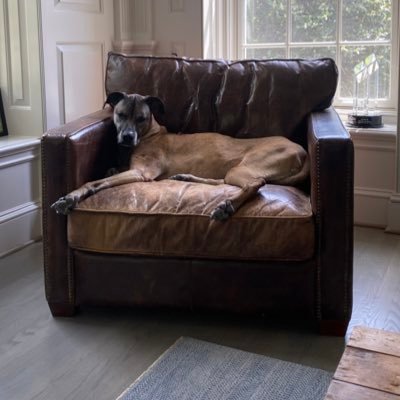
You are a GUI agent. You are given a task and a screenshot of the screen. Output one action in this format:
    pyautogui.click(x=<x>, y=<y>)
    Task: Click on the armsof chair
    This screenshot has width=400, height=400.
    Given the screenshot: What is the action you would take?
    pyautogui.click(x=333, y=134), pyautogui.click(x=68, y=129)